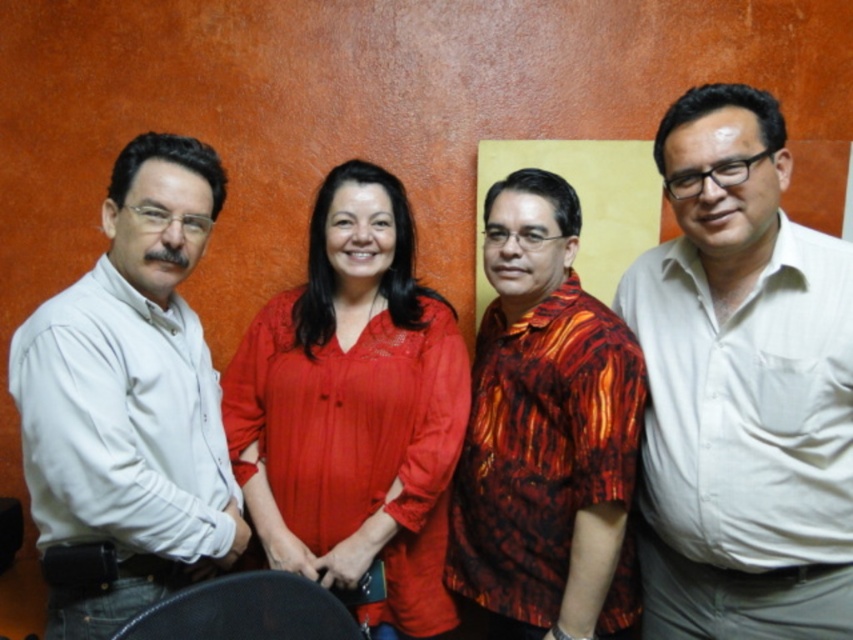
Is the position of white matte shirt at left less distant than that of reddish-brown patterned shirt at center?

Yes, it is in front of reddish-brown patterned shirt at center.

Between white matte shirt at left and reddish-brown patterned shirt at center, which one appears on the right side from the viewer's perspective?

Positioned to the right is reddish-brown patterned shirt at center.

Who is more forward, (x=175, y=349) or (x=569, y=388)?

Point (x=569, y=388) is in front.

Locate an element on the screen. This screenshot has height=640, width=853. white matte shirt at left is located at coordinates (131, 396).

Can you confirm if white cotton shirt at right is wider than matte red blouse at center?

No.

Is white cotton shirt at right above matte red blouse at center?

Yes.

Does point (734, 243) come behind point (310, 340)?

No, it is not.

Locate an element on the screen. This screenshot has height=640, width=853. white cotton shirt at right is located at coordinates (741, 388).

Is white cotton shirt at right wider than white matte shirt at left?

Incorrect, white cotton shirt at right's width does not surpass white matte shirt at left's.

Who is more forward, (659, 468) or (148, 417)?

Point (148, 417)

Find the location of a particular element. This screenshot has width=853, height=640. white cotton shirt at right is located at coordinates (741, 388).